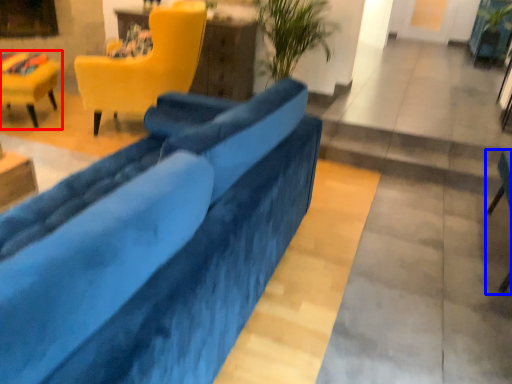
Question: Which object is closer to the camera taking this photo, chair (highlighted by a red box) or chair (highlighted by a blue box)?

Choices:
 (A) chair
 (B) chair

Answer: (B)